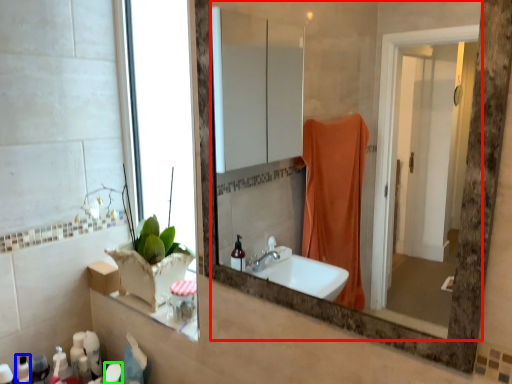
Question: Based on their relative distances, which object is nearer to mirror (highlighted by a red box)? Choose from toiletry (highlighted by a blue box) and toiletry (highlighted by a green box).

Choices:
 (A) toiletry
 (B) toiletry

Answer: (B)